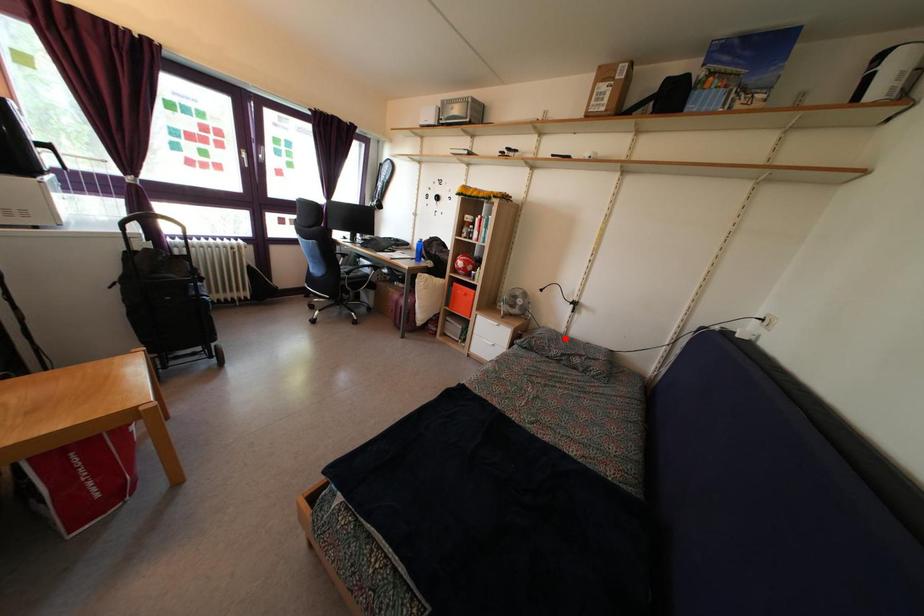
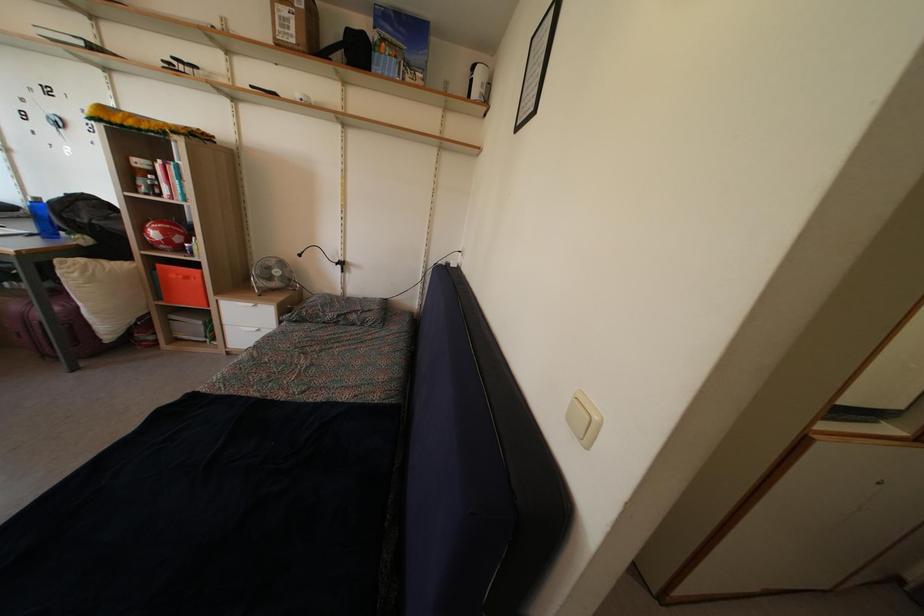
In the second image, find the point that corresponds to the highlighted location in the first image.

(342, 301)